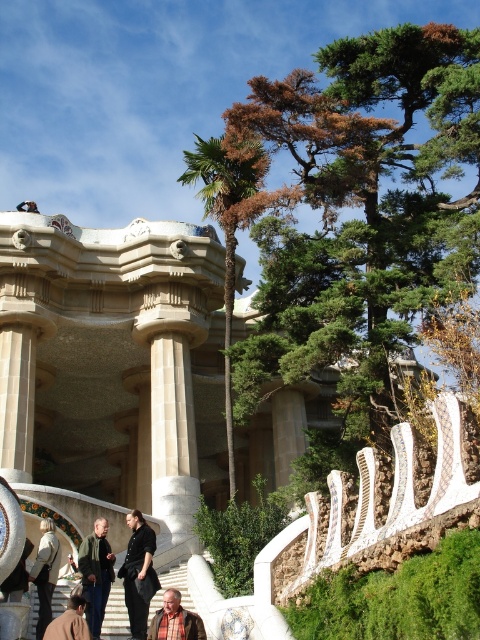
Does white marble stairs at lower center have a lesser height compared to green fuzzy jacket at lower left?

Indeed, white marble stairs at lower center has a lesser height compared to green fuzzy jacket at lower left.

Locate an element on the screen. Image resolution: width=480 pixels, height=640 pixels. white marble stairs at lower center is located at coordinates (116, 614).

Find the location of a particular element. Image resolution: width=480 pixels, height=640 pixels. white marble stairs at lower center is located at coordinates (116, 614).

Can you confirm if green leafy palm tree at center is shorter than white marble stairs at lower center?

No.

Which is in front, point (253, 180) or point (32, 637)?

Point (32, 637)

You are a GUI agent. You are given a task and a screenshot of the screen. Output one action in this format:
    pyautogui.click(x=<x>, y=<y>)
    Task: Click on the green leafy palm tree at center
    
    Given the screenshot: What is the action you would take?
    pyautogui.click(x=226, y=228)

Measure the distance between green fuzzy jacket at lower left and camera.

green fuzzy jacket at lower left is 132.29 feet away from camera.

Is the position of green fuzzy jacket at lower left less distant than that of brown leather jacket at lower left?

No, it is not.

Does point (85, 540) come behind point (71, 630)?

That is True.

Where is `green fuzzy jacket at lower left`? green fuzzy jacket at lower left is located at coordinates (96, 573).